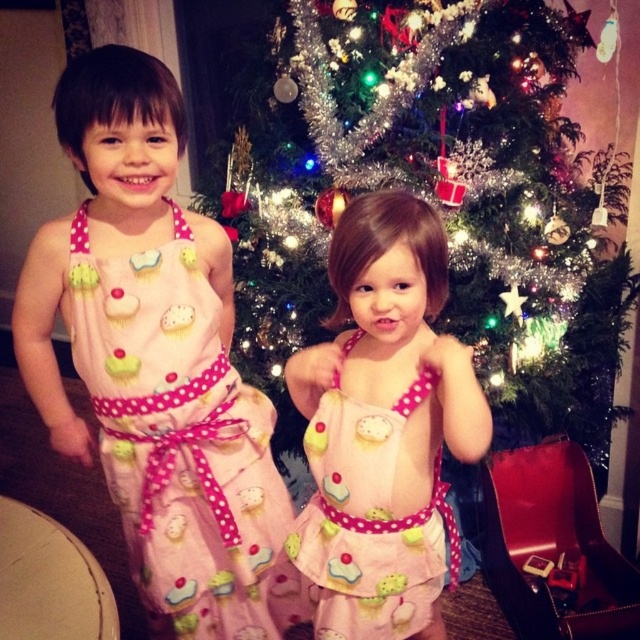
You are a photographer standing in front of the shiny tinsel christmas tree at center and the pink polka dot fabric dress at center. You want to take a photo of both objects in the same frame. Which object should you focus on first to ensure both are in focus?

The shiny tinsel christmas tree at center is located above the pink polka dot fabric dress at center, so you should focus on the pink polka dot fabric dress at center first to ensure both are in focus.

You are a photographer trying to capture a clear shot of the pink polka dot fabric dress at center and the pink polka dot dress at center. Which one is closer to the camera?

The pink polka dot fabric dress at center is closer to the camera than the pink polka dot dress at center.

You are a photographer taking a picture of the two children in front of the Christmas tree. You need to adjust your camera to focus on both points. Which point is closer to the camera, point (476, 122) or point (224, 449)?

Point (476, 122) is further to the viewer than point (224, 449), so the point closer to the camera is point (224, 449).